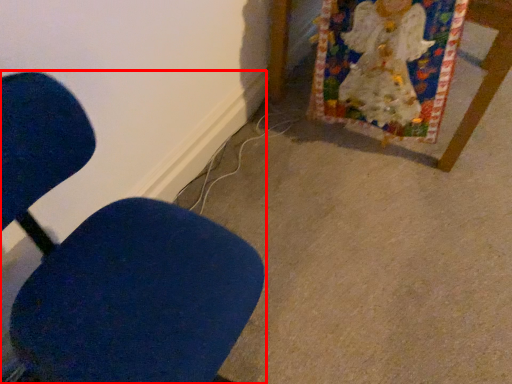
Question: From the image's perspective, considering the relative positions of chair (annotated by the red box) and furniture in the image provided, where is chair (annotated by the red box) located with respect to the staircase?

Choices:
 (A) above
 (B) below

Answer: (B)